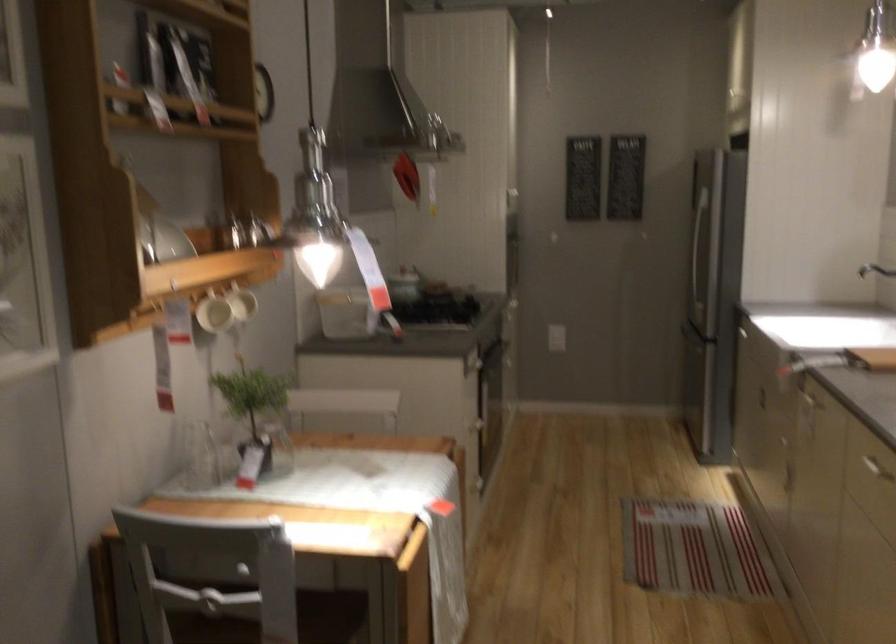
Identify the location of refrigerator door handle. This screenshot has height=644, width=896. (699, 250).